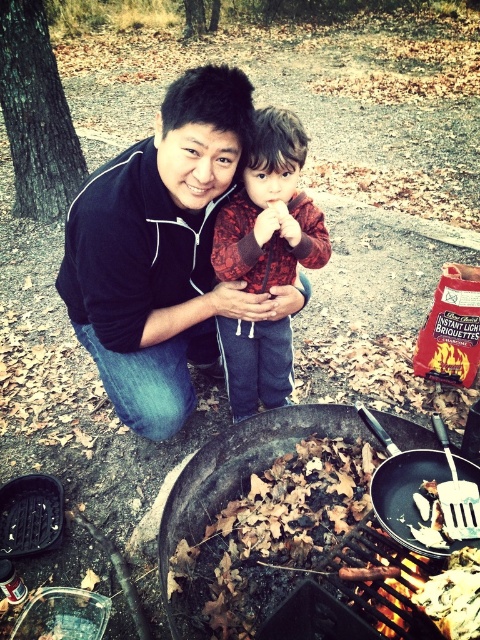
Does black matte jacket at center lie in front of red plaid shirt at center?

Yes, black matte jacket at center is in front of red plaid shirt at center.

Can you confirm if black matte jacket at center is taller than red plaid shirt at center?

Correct, black matte jacket at center is much taller as red plaid shirt at center.

Locate an element on the screen. black matte jacket at center is located at coordinates (158, 252).

Identify the location of black matte jacket at center. (158, 252).

Does charcoal grill at center have a lesser height compared to red plaid shirt at center?

Yes.

Who is more forward, (432, 552) or (249, 180)?

Point (432, 552)

Is point (254, 470) closer to viewer compared to point (313, 220)?

No, it is behind (313, 220).

Where is `charcoal grill at center`? charcoal grill at center is located at coordinates (297, 524).

Can you confirm if charcoal grill at center is positioned above black matte frying pan at lower center?

Actually, charcoal grill at center is below black matte frying pan at lower center.

Which is below, charcoal grill at center or black matte frying pan at lower center?

charcoal grill at center

Which is in front, point (277, 554) or point (383, 490)?

Positioned in front is point (383, 490).

Locate an element on the screen. charcoal grill at center is located at coordinates click(x=297, y=524).